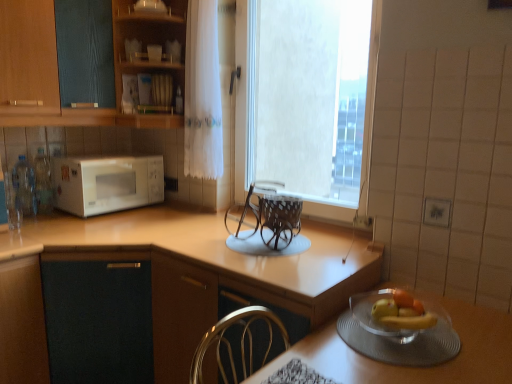
Find the location of `empty space that is to the right of brown woven basket at center`. empty space that is to the right of brown woven basket at center is located at coordinates (335, 247).